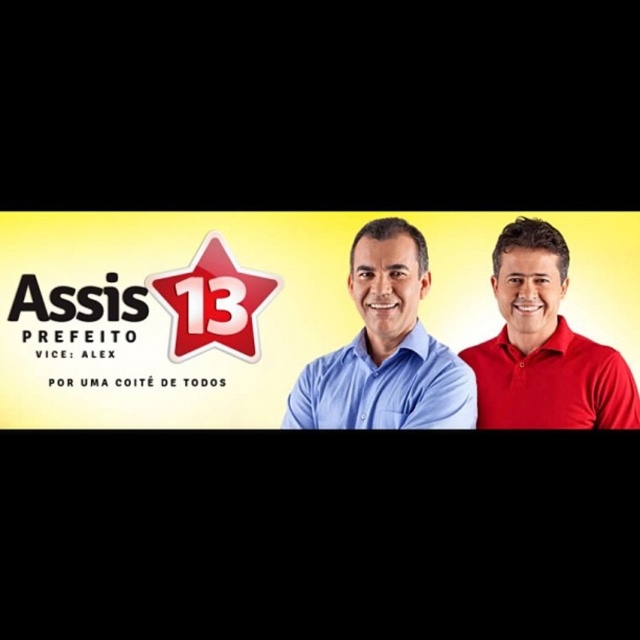
You are designing a poster and want to place a photo of a supporter wearing a red smooth polo shirt at right next to the matte red star at center. Given their widths, which object should be placed first to ensure they fit side by side without overlapping?

The red smooth polo shirt at right is wider than the matte red star at center, so place the red smooth polo shirt at right first to ensure there is enough space for both when placing them side by side.

You are a photographer taking a group photo of the campaign team. You notice the blue shirt at center and the red smooth polo shirt at right. Which team member should you ask to crouch slightly to balance the composition?

The blue shirt at center is not as tall as the red smooth polo shirt at right, so you should ask the taller red smooth polo shirt at right to crouch slightly to balance the composition.

In the political campaign poster with a yellow background, you see a man wearing a red smooth polo shirt at right and a matte red star at center. Which object is bigger?

The red smooth polo shirt at right is larger than the matte red star at center.